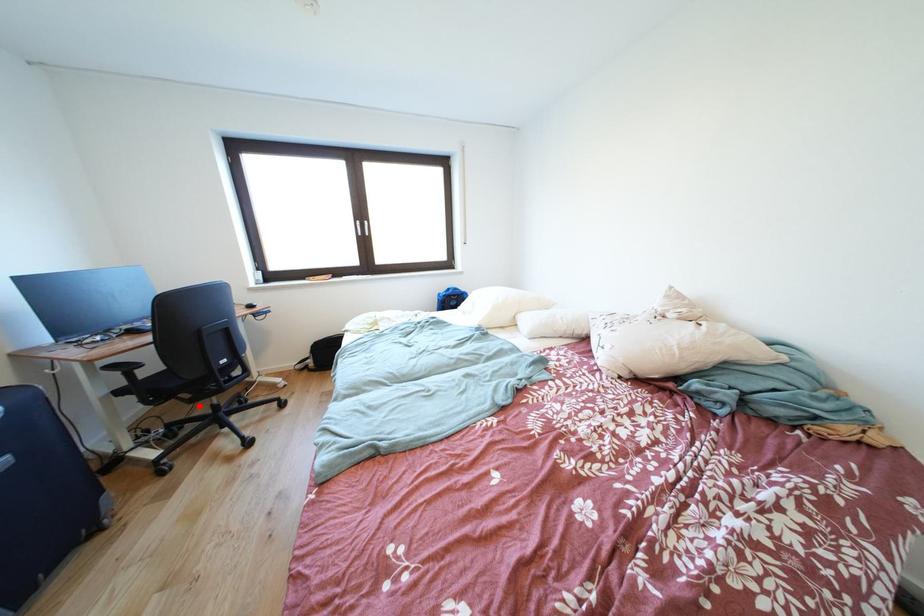
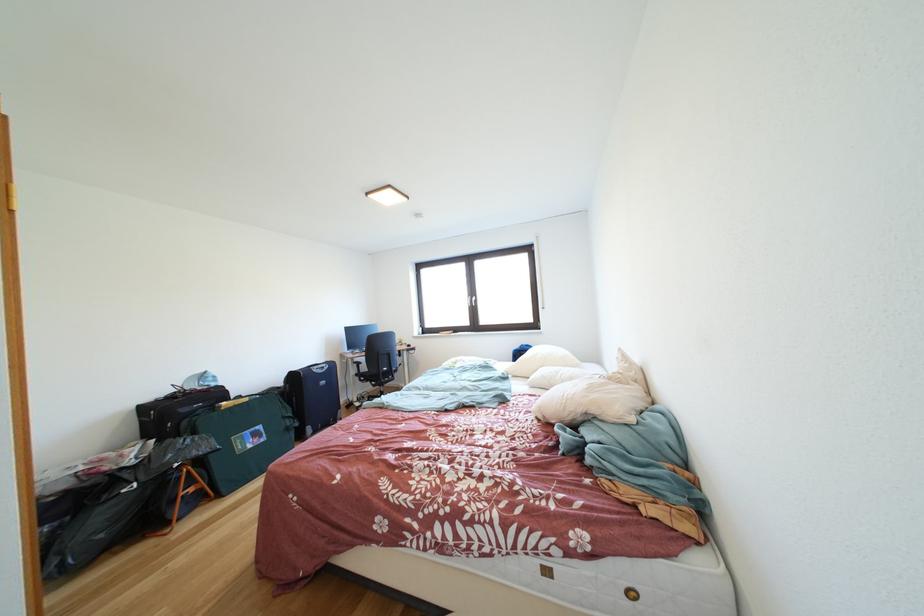
Question: I am providing you with two images of the same scene from different viewpoints. In image1, a red point is highlighted. Considering the same 3D point in image2, which of the following is correct?

Choices:
 (A) It is closer
 (B) It is farther

Answer: (B)